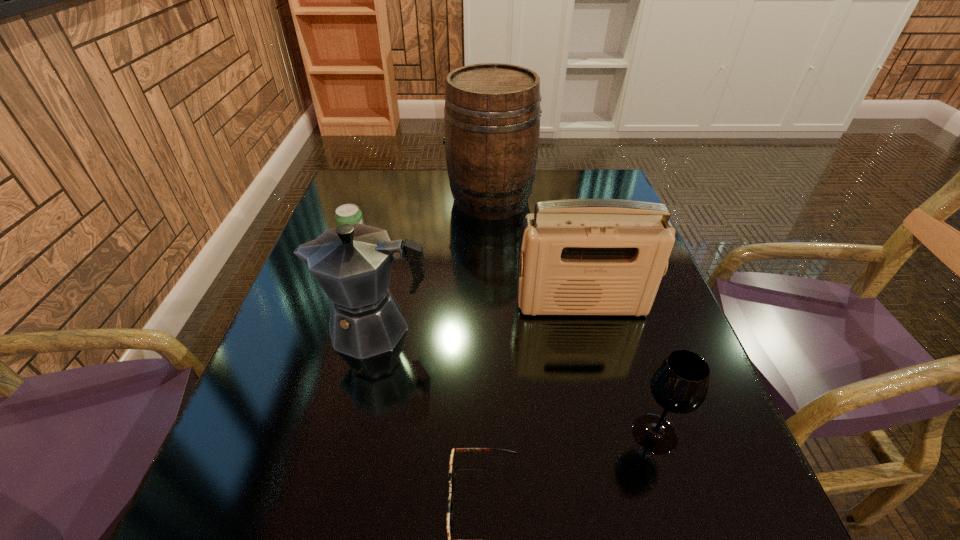
Locate an element on the screen. vacant region that satisfies the following two spatial constraints: 1. on the front-facing side of the radio receiver; 2. on the left side of the second nearest object is located at coordinates (612, 434).

Locate an element on the screen. Image resolution: width=960 pixels, height=540 pixels. free point that satisfies the following two spatial constraints: 1. on the front-facing side of the radio receiver; 2. at the spout of the coffeepot is located at coordinates (588, 328).

You are a GUI agent. You are given a task and a screenshot of the screen. Output one action in this format:
    pyautogui.click(x=<x>, y=<y>)
    Task: Click on the free space that satisfies the following two spatial constraints: 1. on the front side of the second farthest object; 2. on the left side of the fifth farthest object
    
    Given the screenshot: What is the action you would take?
    pyautogui.click(x=295, y=434)

In order to click on free spot that satisfies the following two spatial constraints: 1. at the spout of the coffeepot; 2. on the back side of the third shortest object in this screenshot , I will do `click(350, 434)`.